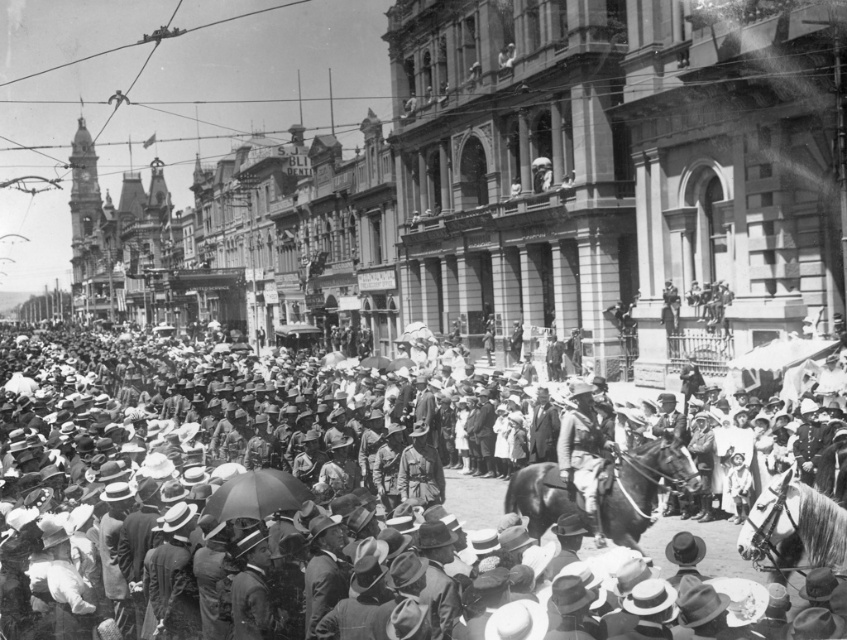
Question: Which point appears farthest from the camera in this image?

Choices:
 (A) tap(37, 380)
 (B) tap(796, 554)
 (C) tap(607, 476)
 (D) tap(612, 484)

Answer: (A)

Question: From the image, what is the correct spatial relationship of matte black crowd at center in relation to camouflage fabric uniform at center?

Choices:
 (A) left
 (B) right

Answer: (A)

Question: Which of the following is the farthest from the observer?

Choices:
 (A) camouflage fabric uniform at center
 (B) shiny brown horse at center
 (C) shiny brown horse at lower right

Answer: (A)

Question: Does matte black crowd at center come behind shiny brown horse at center?

Choices:
 (A) no
 (B) yes

Answer: (A)

Question: Which object is closer to the camera taking this photo?

Choices:
 (A) matte black crowd at center
 (B) shiny brown horse at lower right
 (C) shiny brown horse at center

Answer: (A)

Question: Can you confirm if matte black crowd at center is thinner than shiny brown horse at center?

Choices:
 (A) no
 (B) yes

Answer: (A)